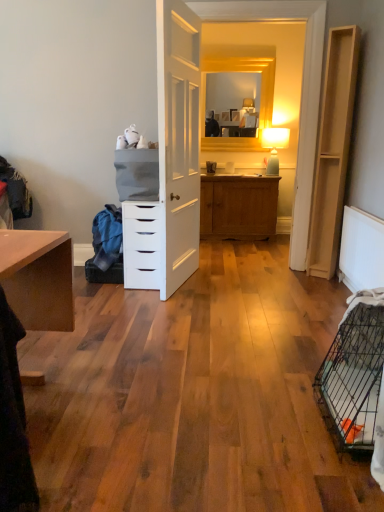
The height and width of the screenshot is (512, 384). Find the location of `empty space that is ontop of light wood/file cabinet at right (from a real-world perspective)`. empty space that is ontop of light wood/file cabinet at right (from a real-world perspective) is located at coordinates (343, 28).